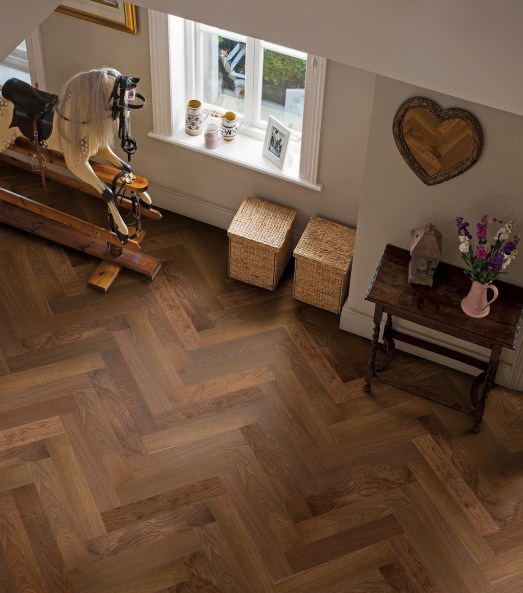
The height and width of the screenshot is (593, 523). Find the location of `wicker basket`. wicker basket is located at coordinates (316, 292).